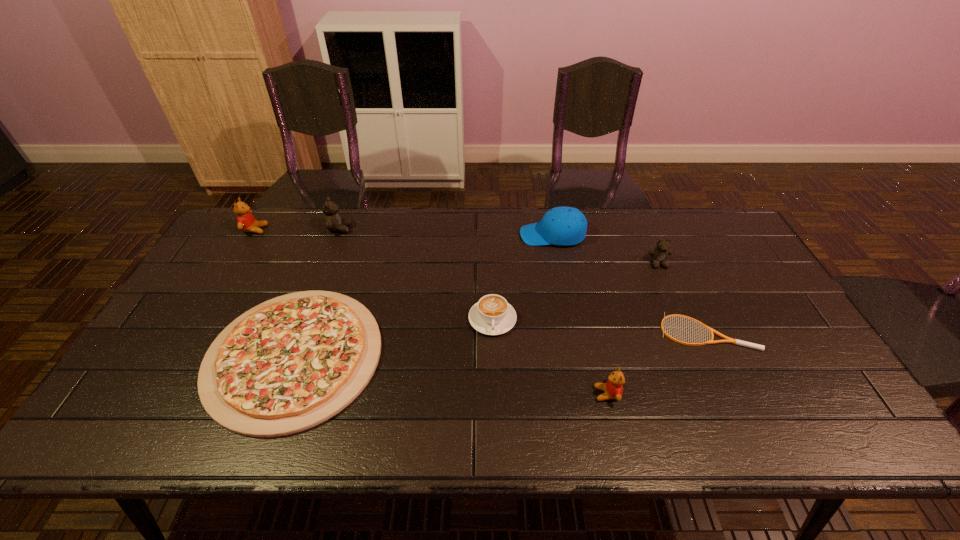
You are a GUI agent. You are given a task and a screenshot of the screen. Output one action in this format:
    pyautogui.click(x=<x>, y=<y>)
    Task: Click on the leftmost teddy bear
    
    Given the screenshot: What is the action you would take?
    tap(246, 222)

Find the location of a particular element. The height and width of the screenshot is (540, 960). the bigger red teddy bear is located at coordinates (246, 222).

At what (x,y) coordinates should I click in order to perform the action: click on the bigger brown teddy bear. Please return your answer as a coordinate pair (x, y). This screenshot has height=540, width=960. Looking at the image, I should click on (333, 222).

The width and height of the screenshot is (960, 540). Find the location of `the farther brown teddy bear`. the farther brown teddy bear is located at coordinates (333, 222).

Find the location of a particular element. cap is located at coordinates (563, 226).

Locate an element on the screen. the nearer brown teddy bear is located at coordinates (659, 255).

This screenshot has width=960, height=540. I want to click on the fifth nearest object, so click(x=659, y=255).

Locate an element on the screen. the smaller red teddy bear is located at coordinates (613, 389).

Locate an element on the screen. The image size is (960, 540). the right red teddy bear is located at coordinates (613, 389).

Find the location of a particular element. The width and height of the screenshot is (960, 540). white cappuccino is located at coordinates (492, 315).